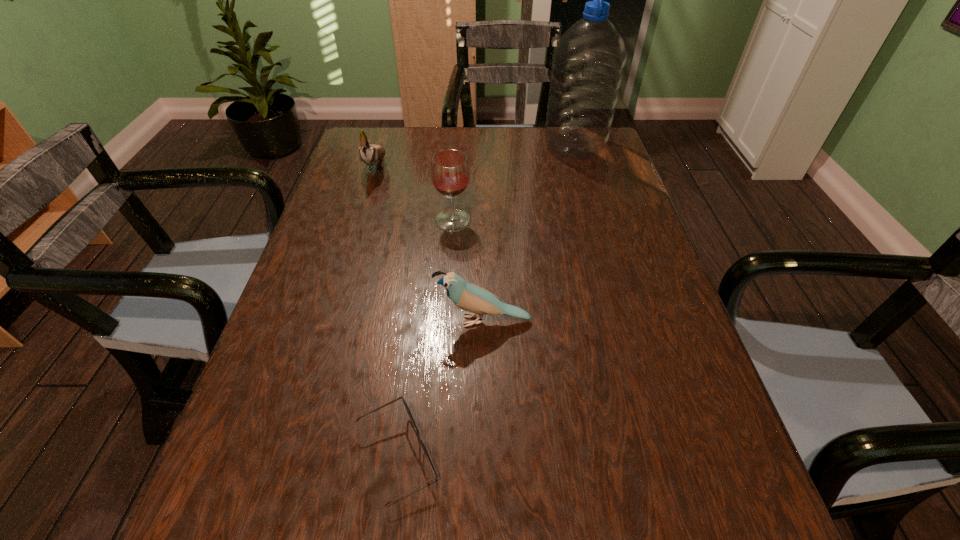
Locate an element on the screen. The image size is (960, 540). the rightmost object is located at coordinates (588, 63).

This screenshot has height=540, width=960. In order to click on water jug in this screenshot , I will do `click(588, 63)`.

Where is `wineglass`? The image size is (960, 540). wineglass is located at coordinates (450, 172).

This screenshot has height=540, width=960. Identify the location of the left bird. (370, 154).

Find the location of a particular element. This screenshot has width=960, height=540. the leftmost object is located at coordinates (370, 154).

Image resolution: width=960 pixels, height=540 pixels. In order to click on the right bird in this screenshot , I will do `click(467, 296)`.

Where is `the second nearest object`? Image resolution: width=960 pixels, height=540 pixels. the second nearest object is located at coordinates (467, 296).

This screenshot has height=540, width=960. Find the location of `spectacles`. spectacles is located at coordinates (409, 413).

Where is `the nearest object`? The height and width of the screenshot is (540, 960). the nearest object is located at coordinates (409, 413).

Identify the location of blank space located on the left of the water jug. (430, 146).